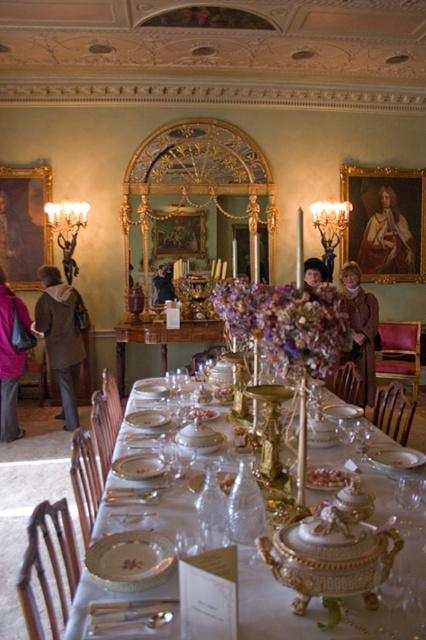
You are standing at the entrance of the dining room and see two points marked on the floor. The first point is labeled as point (x=117, y=625) and the second is point (x=408, y=513). If you want to walk from the entrance to the point that is closer to the table, which point should you head towards?

Point (x=117, y=625) is in front of point (x=408, y=513), so it is closer to the table. Therefore, you should head towards point (x=117, y=625).

Consider the image. You are a server at a formal dinner and need to place a dessert plate between the polished silver spoon at center and the transparent glass wine glass at table center. What is the minimum distance you should leave between the spoon and the wine glass to ensure the plate fits?

The minimum distance should be at least 34.45 inches to accommodate the dessert plate between the polished silver spoon at center and the transparent glass wine glass at table center, as they are currently 34.45 inches apart.